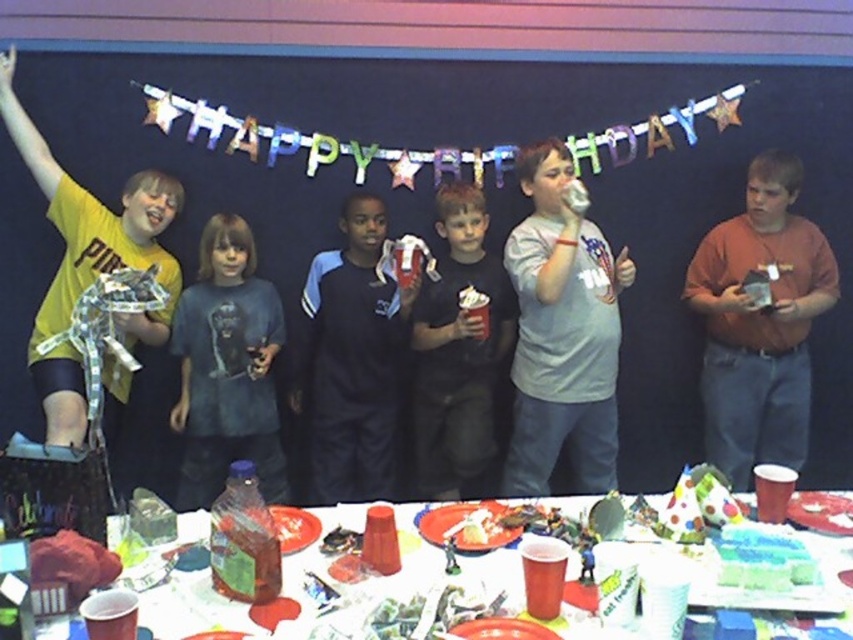
Question: Does dark blue t-shirt at center come in front of blue frosted cake at lower center?

Choices:
 (A) yes
 (B) no

Answer: (B)

Question: Is gray matte shirt at center below blue frosted cake at lower center?

Choices:
 (A) no
 (B) yes

Answer: (A)

Question: Is brown cotton shirt at right positioned before gray matte shirt at center?

Choices:
 (A) no
 (B) yes

Answer: (A)

Question: Which object appears closest to the camera in this image?

Choices:
 (A) dark blue t-shirt at center
 (B) dark blue jersey at center

Answer: (A)

Question: Which point appears farthest from the camera in this image?

Choices:
 (A) (228, 266)
 (B) (639, 545)
 (C) (444, 193)

Answer: (C)

Question: Which of these objects is positioned closest to the gray matte shirt at center?

Choices:
 (A) brown cotton shirt at right
 (B) dark blue t-shirt at center
 (C) dark blue jersey at center
 (D) black matte cup at center

Answer: (D)